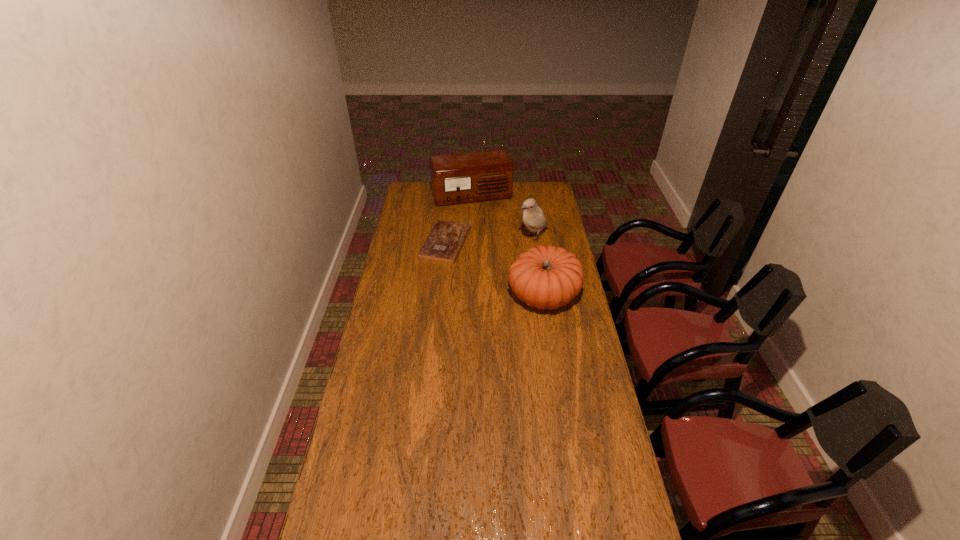
Identify the location of object that is the third closest to the nearest object. The width and height of the screenshot is (960, 540). (462, 178).

At what (x,y) coordinates should I click in order to perform the action: click on object identified as the third closest to the farthest object. Please return your answer as a coordinate pair (x, y). The width and height of the screenshot is (960, 540). Looking at the image, I should click on pos(546,277).

Locate an element on the screen. Image resolution: width=960 pixels, height=540 pixels. free space in the image that satisfies the following two spatial constraints: 1. on the back side of the bird; 2. on the right side of the Bible is located at coordinates (446, 239).

The width and height of the screenshot is (960, 540). I want to click on free spot that satisfies the following two spatial constraints: 1. on the front side of the Bible; 2. on the right side of the pumpkin, so click(441, 295).

At what (x,y) coordinates should I click in order to perform the action: click on free location that satisfies the following two spatial constraints: 1. on the front side of the nearest object; 2. on the right side of the bird. Please return your answer as a coordinate pair (x, y). The height and width of the screenshot is (540, 960). Looking at the image, I should click on (542, 295).